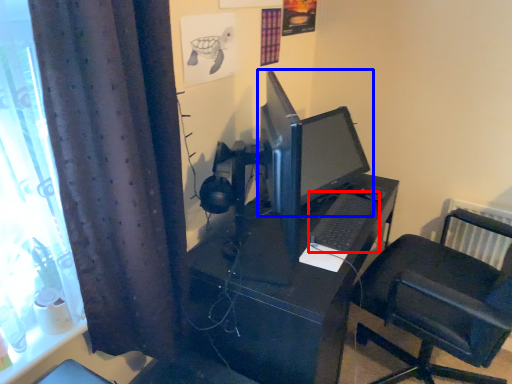
Question: Which of the following is the closest to the observer, computer keyboard (highlighted by a red box) or computer monitor (highlighted by a blue box)?

Choices:
 (A) computer keyboard
 (B) computer monitor

Answer: (B)